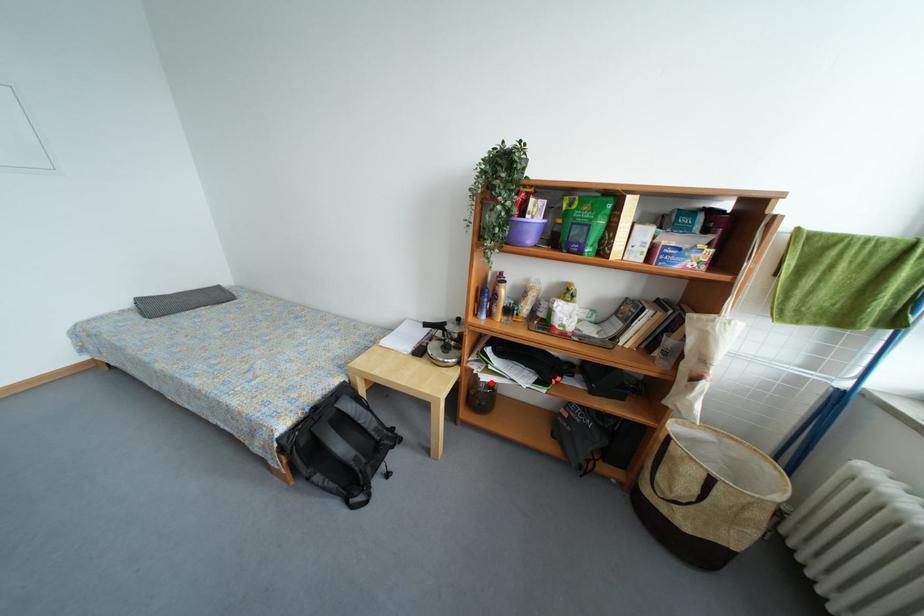
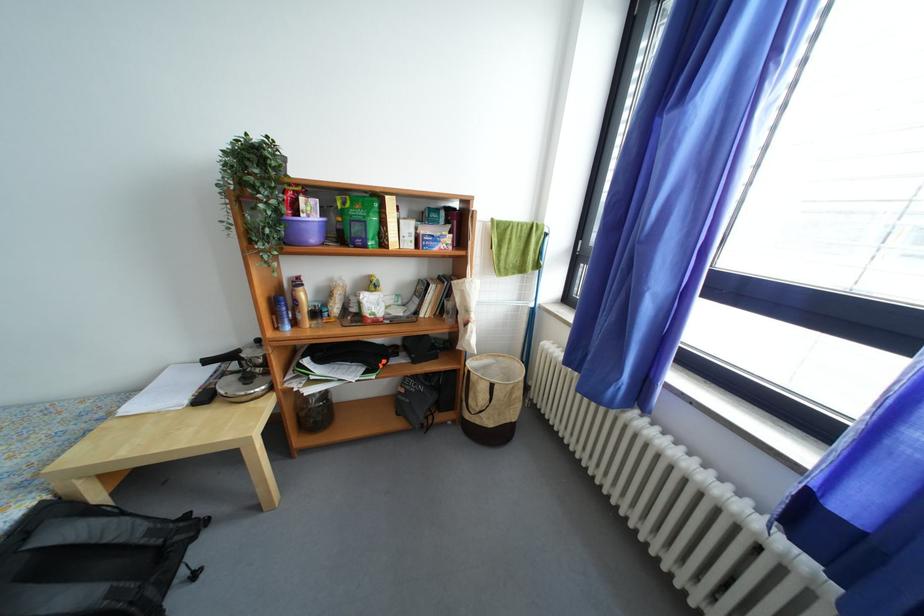
Locate, in the second image, the point that corresponds to the highlighted location in the first image.

(315, 395)